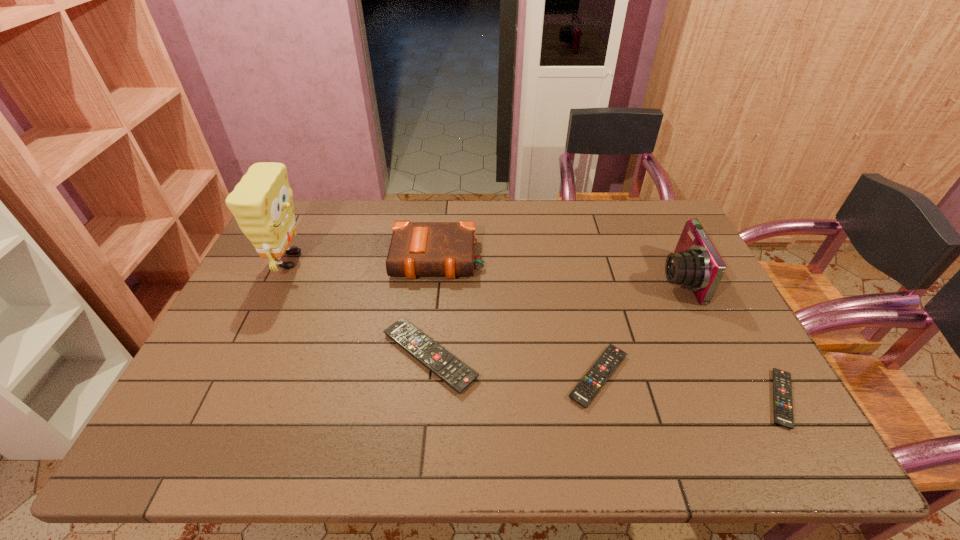
In the current image, all remote controls are evenly spaced. To maintain this equal spacing, where should an additional remote control be placed on the left? Please point out a free spot. Please provide its 2D coordinates. Your answer should be formatted as a tuple, i.e. [(x, y)], where the tuple contains the x and y coordinates of a point satisfying the conditions above.

[(274, 338)]